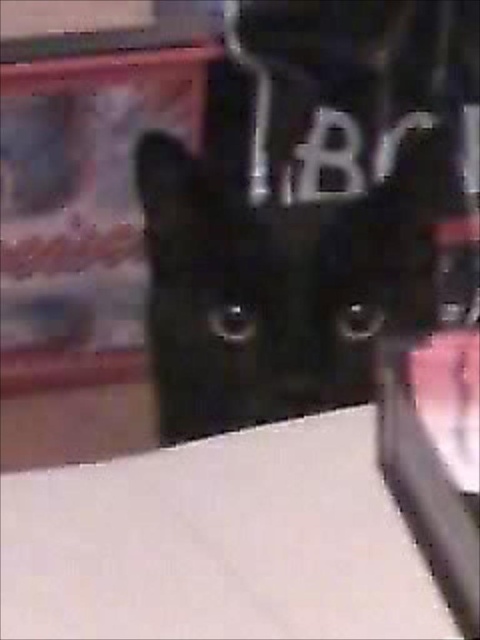
Between point (344, 458) and point (159, 276), which one is positioned in front?

Point (344, 458) is in front.

Does white matte table at lower left appear over black glossy cat at center?

Incorrect, white matte table at lower left is not positioned above black glossy cat at center.

Where is `white matte table at lower left`? Image resolution: width=480 pixels, height=640 pixels. white matte table at lower left is located at coordinates (218, 541).

Locate an element on the screen. The image size is (480, 640). white matte table at lower left is located at coordinates (218, 541).